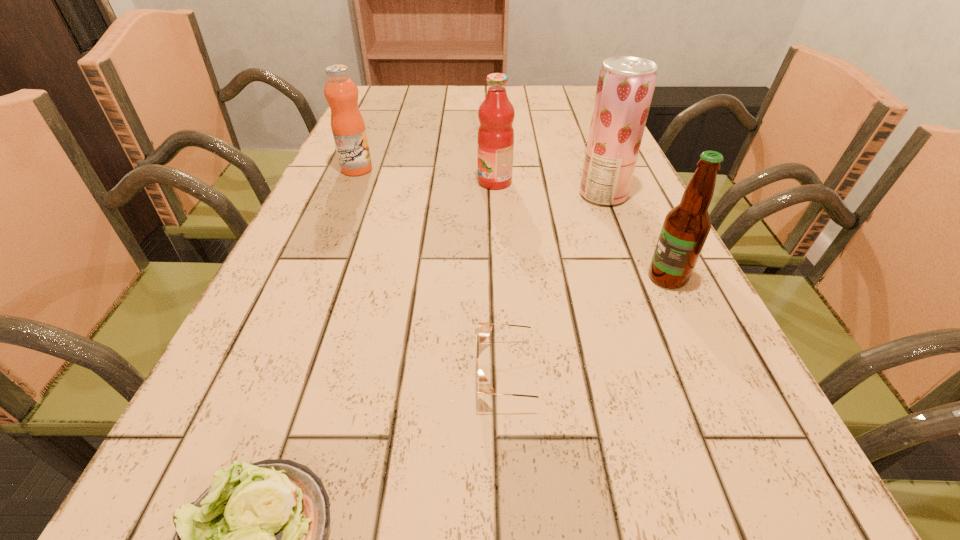
Point out which object is positioned as the second nearest to the nearest object. Please provide its 2D coordinates. Your answer should be formatted as a tuple, i.e. [(x, y)], where the tuple contains the x and y coordinates of a point satisfying the conditions above.

[(686, 227)]

Image resolution: width=960 pixels, height=540 pixels. Identify the location of fruit juice object that ranks as the second closest to the leftmost fruit juice. (625, 87).

Select which fruit juice is the second closest to the leftmost fruit juice. Please provide its 2D coordinates. Your answer should be formatted as a tuple, i.e. [(x, y)], where the tuple contains the x and y coordinates of a point satisfying the conditions above.

[(625, 87)]